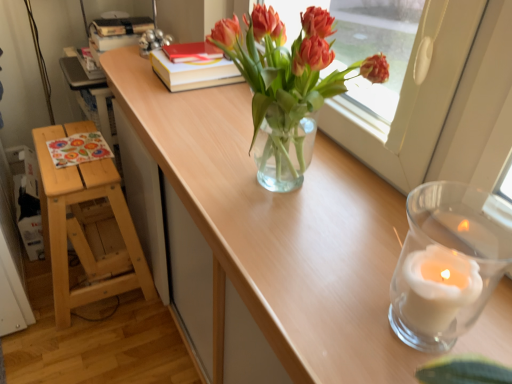
Identify the location of vacant space underneath translucent glass vase at center (from a real-world perspective). The image size is (512, 384). (277, 195).